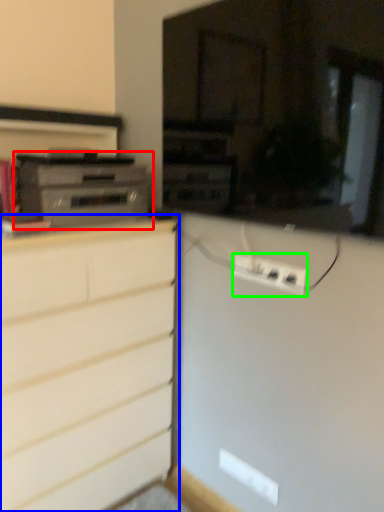
Question: Estimate the real-world distances between objects in this image. Which object is closer to home appliance (highlighted by a red box), chest of drawers (highlighted by a blue box) or electric outlet (highlighted by a green box)?

Choices:
 (A) chest of drawers
 (B) electric outlet

Answer: (A)